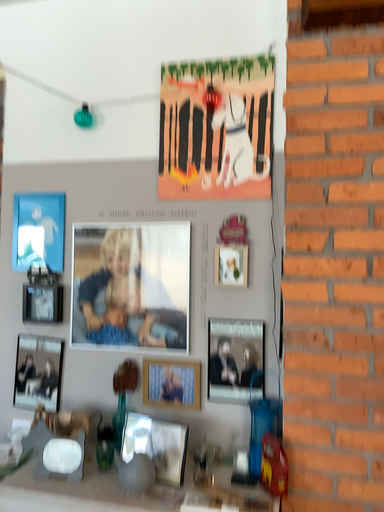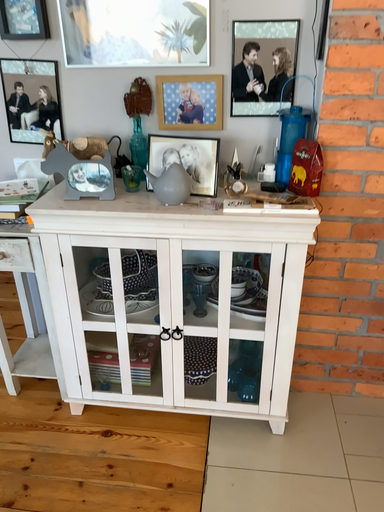
Question: Which way did the camera rotate in the video?

Choices:
 (A) rotated right
 (B) rotated left

Answer: (A)